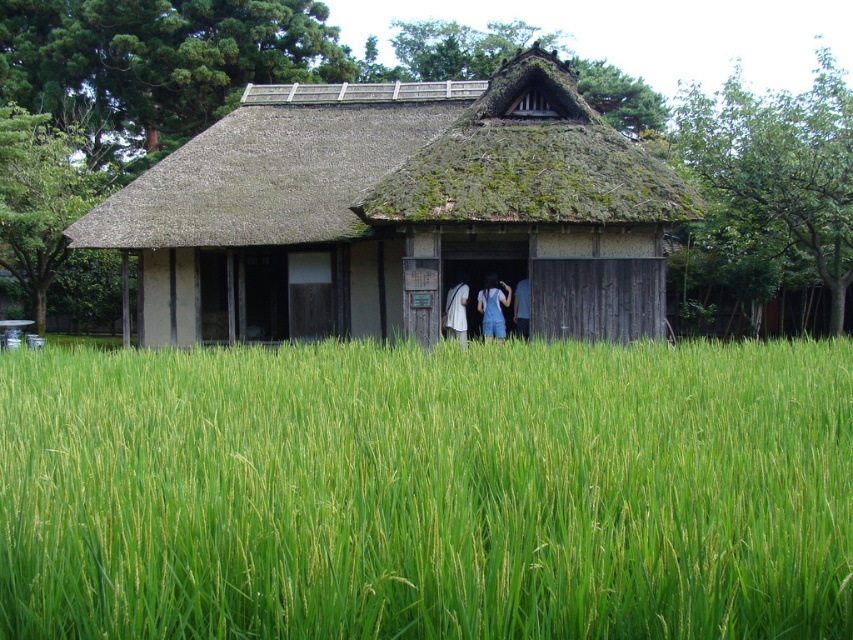
This screenshot has width=853, height=640. I want to click on thatched wood hut at center, so tap(397, 212).

Does point (161, 220) lie behind point (512, 163)?

Yes, point (161, 220) is behind point (512, 163).

At what (x,y) coordinates should I click in order to perform the action: click on thatched wood hut at center. Please return your answer as a coordinate pair (x, y). This screenshot has height=640, width=853. Looking at the image, I should click on (397, 212).

Who is more distant from viewer, (494, 276) or (515, 308)?

Point (494, 276)

Measure the distance between point (482, 292) and camera.

They are 57.38 feet apart.

At what (x,y) coordinates should I click in order to perform the action: click on denim overalls at center. Please return your answer as a coordinate pair (x, y). Image resolution: width=853 pixels, height=640 pixels. Looking at the image, I should click on (x=492, y=307).

What do you see at coordinates (531, 161) in the screenshot? I see `green mossy thatch at center` at bounding box center [531, 161].

Does point (572, 209) lie behind point (482, 310)?

No, (572, 209) is closer to viewer.

This screenshot has width=853, height=640. What are the coordinates of `green mossy thatch at center` in the screenshot? It's located at (531, 161).